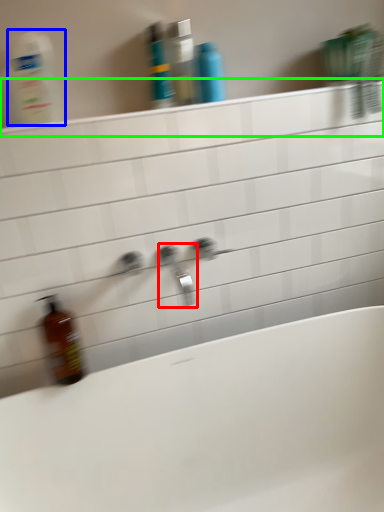
Question: Considering the real-world distances, which object is farthest from tap (highlighted by a red box)? cleaning product (highlighted by a blue box) or ledge (highlighted by a green box)?

Choices:
 (A) cleaning product
 (B) ledge

Answer: (A)